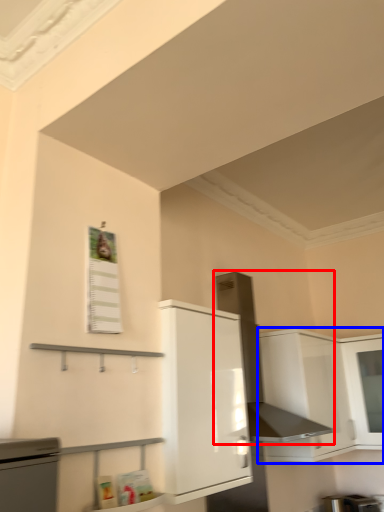
Question: Among these objects, which one is nearest to the camera, exhaust hood (highlighted by a red box) or cabinetry (highlighted by a blue box)?

Choices:
 (A) exhaust hood
 (B) cabinetry

Answer: (A)